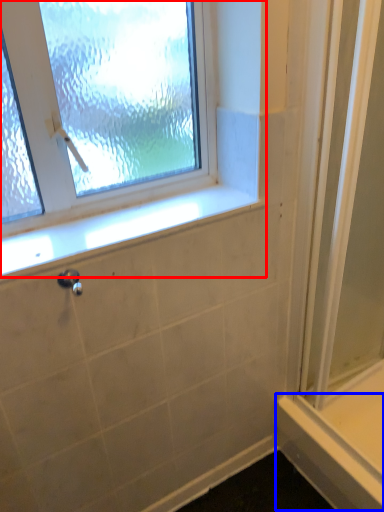
Question: Which object is further to the camera taking this photo, window (highlighted by a red box) or ledge (highlighted by a blue box)?

Choices:
 (A) window
 (B) ledge

Answer: (B)